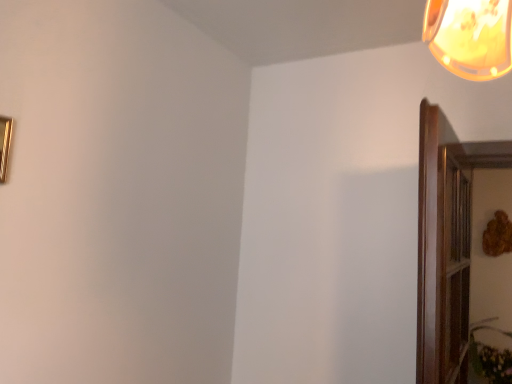
This screenshot has height=384, width=512. What do you see at coordinates (5, 145) in the screenshot? I see `gold metallic picture frame at upper left` at bounding box center [5, 145].

The image size is (512, 384). In order to click on gold metallic picture frame at upper left in this screenshot , I will do `click(5, 145)`.

What do you see at coordinates (487, 355) in the screenshot?
I see `green leafy plant at lower right` at bounding box center [487, 355].

Find the location of a particular element. This screenshot has width=512, height=384. green leafy plant at lower right is located at coordinates (487, 355).

At what (x,y) coordinates should I click in order to perform the action: click on gold metallic picture frame at upper left. Please return your answer as a coordinate pair (x, y). Looking at the image, I should click on (5, 145).

Considering the relative positions of gold metallic picture frame at upper left and green leafy plant at lower right in the image provided, is gold metallic picture frame at upper left to the left or to the right of green leafy plant at lower right?

From the image, it's evident that gold metallic picture frame at upper left is to the left of green leafy plant at lower right.

Between gold metallic picture frame at upper left and green leafy plant at lower right, which one is positioned behind?

green leafy plant at lower right is further from the camera.

Is point (7, 164) in front of point (496, 376)?

Yes, it is in front of point (496, 376).

From the image's perspective, which is below, gold metallic picture frame at upper left or green leafy plant at lower right?

From the image's view, green leafy plant at lower right is below.

From a real-world perspective, is gold metallic picture frame at upper left physically located above or below green leafy plant at lower right?

gold metallic picture frame at upper left is situated higher than green leafy plant at lower right in the real world.

Is gold metallic picture frame at upper left wider than green leafy plant at lower right?

No, gold metallic picture frame at upper left is not wider than green leafy plant at lower right.

In terms of height, does gold metallic picture frame at upper left look taller or shorter compared to green leafy plant at lower right?

gold metallic picture frame at upper left is shorter than green leafy plant at lower right.

Based on their sizes in the image, would you say gold metallic picture frame at upper left is bigger or smaller than green leafy plant at lower right?

gold metallic picture frame at upper left is smaller than green leafy plant at lower right.

Is gold metallic picture frame at upper left inside the boundaries of green leafy plant at lower right, or outside?

gold metallic picture frame at upper left is spatially situated outside green leafy plant at lower right.

Is gold metallic picture frame at upper left not close to green leafy plant at lower right?

Yes, gold metallic picture frame at upper left is far from green leafy plant at lower right.

Does gold metallic picture frame at upper left turn towards green leafy plant at lower right?

No, gold metallic picture frame at upper left is not aimed at green leafy plant at lower right.

How many degrees apart are the facing directions of gold metallic picture frame at upper left and green leafy plant at lower right?

The angular difference between gold metallic picture frame at upper left and green leafy plant at lower right is 92.3 degrees.

This screenshot has width=512, height=384. In order to click on picture frame that appears above the green leafy plant at lower right (from a real-world perspective) in this screenshot , I will do `click(5, 145)`.

In the scene shown: Considering the relative positions of green leafy plant at lower right and gold metallic picture frame at upper left in the image provided, is green leafy plant at lower right to the right of gold metallic picture frame at upper left from the viewer's perspective?

Yes.

Which object is closer to the camera taking this photo, green leafy plant at lower right or gold metallic picture frame at upper left?

Positioned in front is gold metallic picture frame at upper left.

Which is nearer, (505, 383) or (9, 118)?

Clearly, point (505, 383) is more distant from the camera than point (9, 118).

From the image's perspective, is green leafy plant at lower right beneath gold metallic picture frame at upper left?

Yes, from the image's perspective, green leafy plant at lower right is beneath gold metallic picture frame at upper left.

From a real-world perspective, which is physically below, green leafy plant at lower right or gold metallic picture frame at upper left?

green leafy plant at lower right, from a real-world perspective.

Does green leafy plant at lower right have a lesser width compared to gold metallic picture frame at upper left?

In fact, green leafy plant at lower right might be wider than gold metallic picture frame at upper left.

In the scene shown: Is green leafy plant at lower right shorter than gold metallic picture frame at upper left?

No, green leafy plant at lower right is not shorter than gold metallic picture frame at upper left.

Considering the relative sizes of green leafy plant at lower right and gold metallic picture frame at upper left in the image provided, is green leafy plant at lower right smaller than gold metallic picture frame at upper left?

No, green leafy plant at lower right is not smaller than gold metallic picture frame at upper left.

Is gold metallic picture frame at upper left located within green leafy plant at lower right?

No, gold metallic picture frame at upper left is not surrounded by green leafy plant at lower right.

Are green leafy plant at lower right and gold metallic picture frame at upper left making contact?

No.

In the scene shown: Is green leafy plant at lower right aimed at gold metallic picture frame at upper left?

No, green leafy plant at lower right is not facing towards gold metallic picture frame at upper left.

Locate an element on the screen. This screenshot has width=512, height=384. plant located behind the gold metallic picture frame at upper left is located at coordinates (487, 355).

Image resolution: width=512 pixels, height=384 pixels. What are the coordinates of `plant that is on the right side of gold metallic picture frame at upper left` in the screenshot? It's located at (487, 355).

Locate an element on the screen. Image resolution: width=512 pixels, height=384 pixels. plant located underneath the gold metallic picture frame at upper left (from a real-world perspective) is located at coordinates (487, 355).